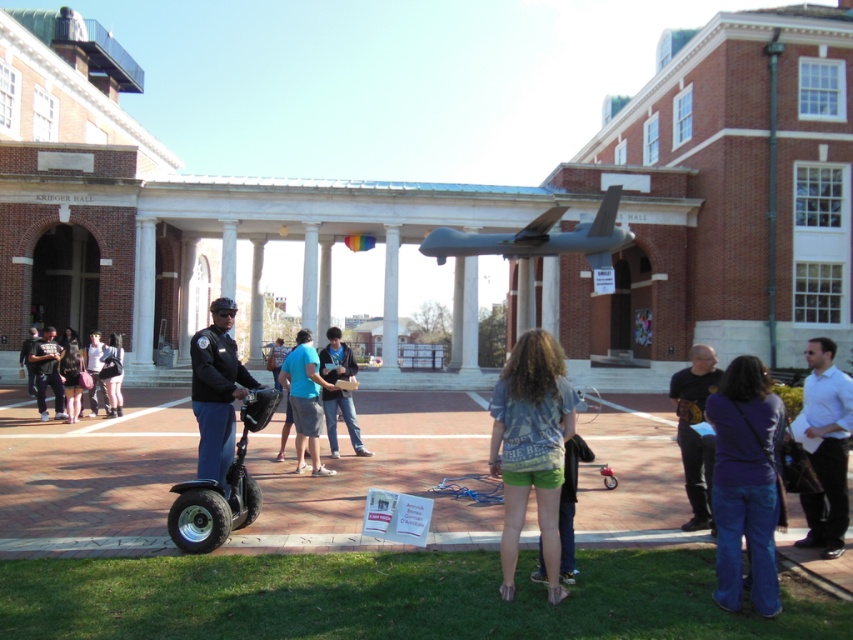
Between white smooth shirt at right and denim jacket at lower left, which one is positioned higher?

white smooth shirt at right is higher up.

Is point (817, 353) in front of point (109, 369)?

Yes.

Who is more distant from viewer, (x=846, y=492) or (x=106, y=412)?

Point (x=106, y=412)

Find the location of a particular element. This screenshot has width=853, height=640. white smooth shirt at right is located at coordinates (827, 448).

Which is above, denim shorts at center or denim shorts at lower left?

denim shorts at lower left

Is denim shorts at center positioned before denim shorts at lower left?

Yes.

Is point (561, 448) less distant than point (85, 355)?

Yes, point (561, 448) is closer to viewer.

This screenshot has width=853, height=640. In order to click on denim shorts at center in this screenshot , I will do `click(531, 449)`.

Does point (61, 372) come in front of point (96, 412)?

That is True.

Does point (33, 360) come behind point (97, 333)?

No, it is in front of (97, 333).

I want to click on dark blue jeans at lower left, so click(65, 376).